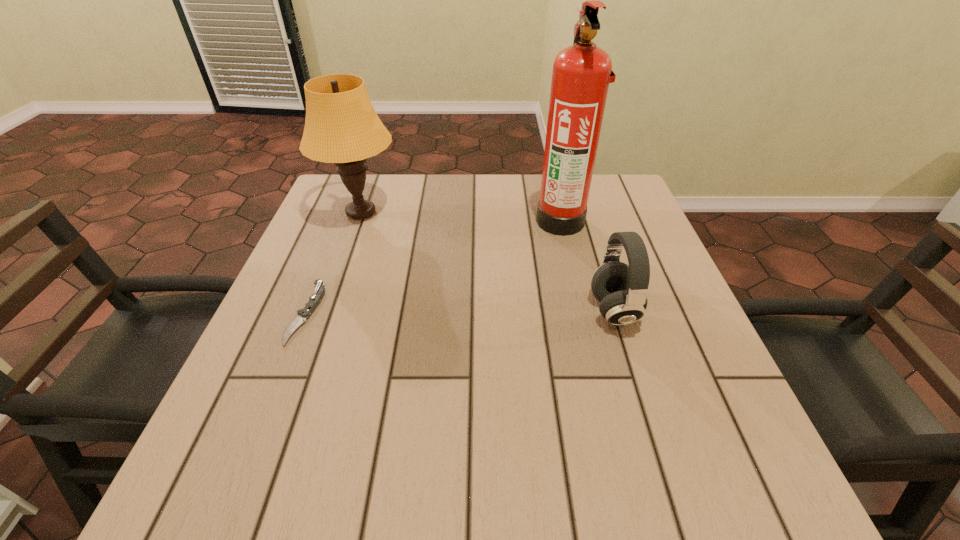
The height and width of the screenshot is (540, 960). What are the coordinates of `free location located on the ear cups of the third tallest object` in the screenshot? It's located at (406, 310).

Image resolution: width=960 pixels, height=540 pixels. I want to click on vacant region located on the right of the pocketknife, so click(x=373, y=313).

Locate an element on the screen. Image resolution: width=960 pixels, height=540 pixels. fire extinguisher at the far edge is located at coordinates (582, 72).

Find the location of `lampshade present at the far edge`. lampshade present at the far edge is located at coordinates (341, 126).

Identify the location of lampshade located at the left edge. (341, 126).

The image size is (960, 540). I want to click on pocketknife located at the left edge, so click(x=314, y=300).

In order to click on fire extinguisher located in the right edge section of the desktop in this screenshot , I will do `click(582, 72)`.

Where is `headset that is at the right edge`? headset that is at the right edge is located at coordinates (622, 290).

You are a GUI agent. You are given a task and a screenshot of the screen. Output one action in this format:
    pyautogui.click(x=<x>, y=<y>)
    Task: Click on the object that is at the far left corner
    Image resolution: width=960 pixels, height=540 pixels.
    Given the screenshot: What is the action you would take?
    pyautogui.click(x=341, y=126)

Locate an element on the screen. This screenshot has height=540, width=960. object located in the far right corner section of the desktop is located at coordinates (582, 72).